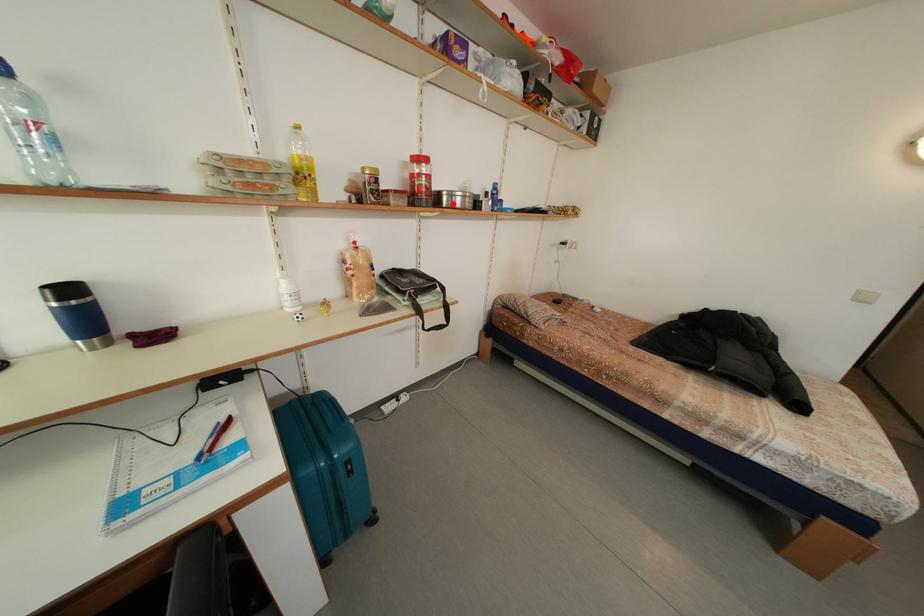
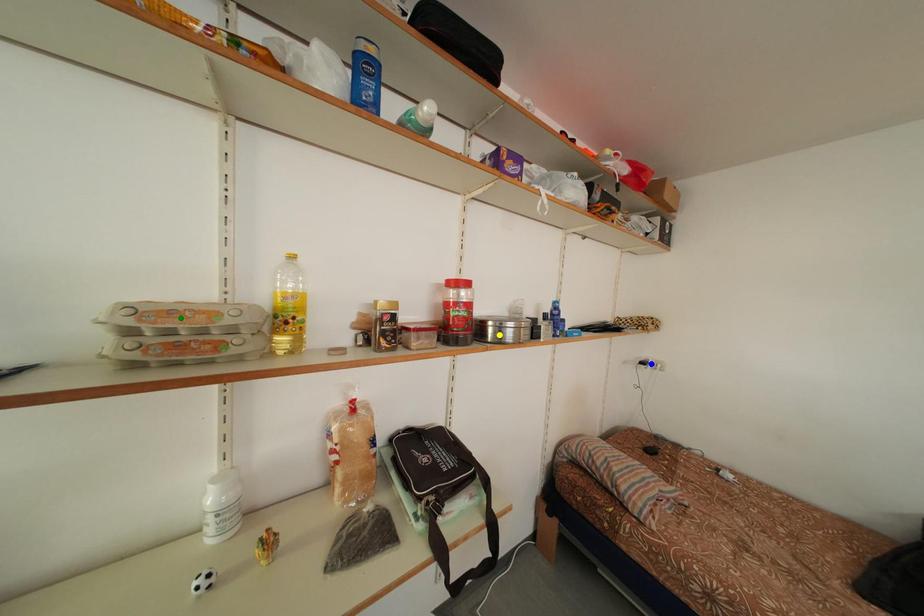
Question: I am providing you with two images of the same scene from different viewpoints. A red point is marked on the first image. You are given multiple points on the second image. Which point in image 2 is actually the same real-world point as the red point in image 1?

Choices:
 (A) yellow point
 (B) green point
 (C) blue point

Answer: (A)